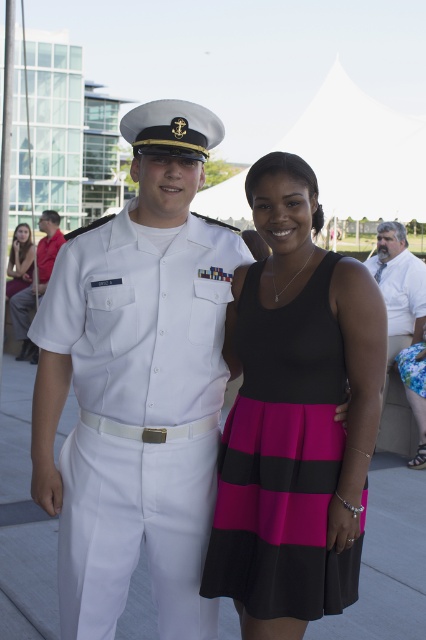
Question: Can you confirm if white matte uniform at center is positioned to the right of white uniform at center?

Choices:
 (A) no
 (B) yes

Answer: (B)

Question: Based on their relative distances, which object is nearer to the white uniform at center?

Choices:
 (A) matte black dress at center
 (B) black matte dress at center

Answer: (A)

Question: Does white cotton shirt at right have a greater width compared to white uniform at center?

Choices:
 (A) yes
 (B) no

Answer: (A)

Question: Is black matte dress at center below white cotton shirt at right?

Choices:
 (A) no
 (B) yes

Answer: (B)

Question: Which object is farther from the camera taking this photo?

Choices:
 (A) white cotton shirt at right
 (B) white uniform at center
 (C) matte black dress at center

Answer: (C)

Question: Which object is farther from the camera taking this photo?

Choices:
 (A) white matte uniform at center
 (B) white cotton shirt at right

Answer: (B)